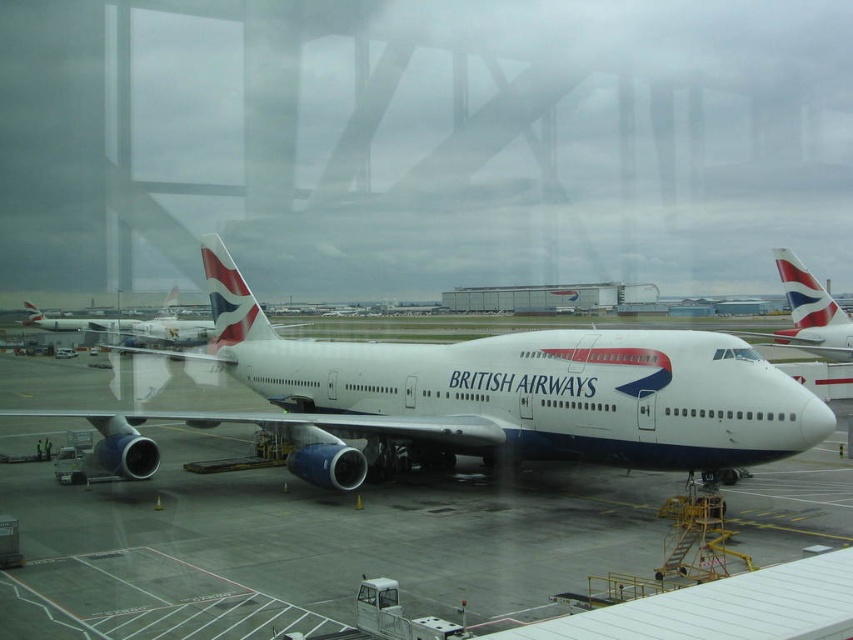
You are an airport inspector checking the dimensions of the aircraft. You observe the white glossy airplane at center and the polished aluminum tail at center. Which part has a greater width?

The white glossy airplane at center has a greater width than the polished aluminum tail at center.

You are standing at the airport window and see the white smooth tarmac at center and the white glossy tail fin at center. Which object is nearer to you?

The white smooth tarmac at center is closer to the viewer than the white glossy tail fin at center.